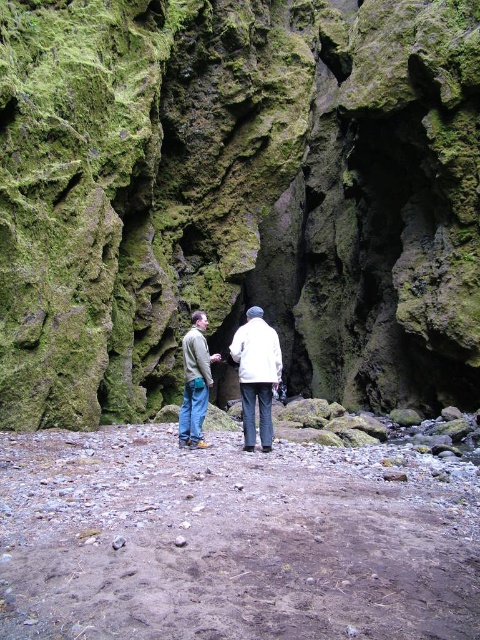
Question: Does white woolen jacket at center have a larger size compared to greenish-gray fabric jacket at center?

Choices:
 (A) no
 (B) yes

Answer: (A)

Question: Which of the following is the farthest from the observer?

Choices:
 (A) greenish-gray fabric jacket at center
 (B) green mossy rock at center

Answer: (A)

Question: Does green mossy rock at center lie in front of white woolen jacket at center?

Choices:
 (A) no
 (B) yes

Answer: (A)

Question: Is green mossy rock at center wider than white woolen jacket at center?

Choices:
 (A) no
 (B) yes

Answer: (B)

Question: Based on their relative distances, which object is farther from the greenish-gray fabric jacket at center?

Choices:
 (A) green mossy rock at center
 (B) white woolen jacket at center

Answer: (A)

Question: Which object is farther from the camera taking this photo?

Choices:
 (A) greenish-gray fabric jacket at center
 (B) green mossy rock at center
 (C) white woolen jacket at center

Answer: (A)